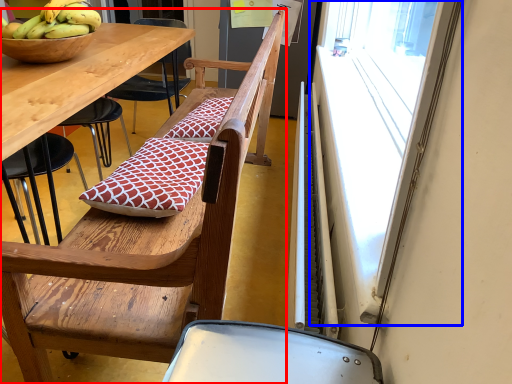
Question: Which of the following is the farthest to the observer, chair (highlighted by a red box) or window screen (highlighted by a blue box)?

Choices:
 (A) chair
 (B) window screen

Answer: (A)